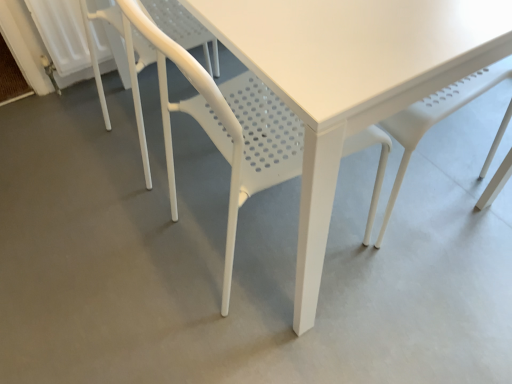
This screenshot has width=512, height=384. What are the coordinates of `vacant area situated to the left side of white plastic chair at center, the second chair in the left-to-right sequence` in the screenshot? It's located at (125, 255).